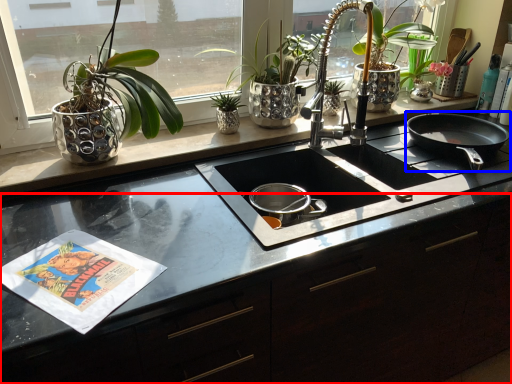
Question: Which object is further to the camera taking this photo, counter (highlighted by a red box) or frying pan (highlighted by a blue box)?

Choices:
 (A) counter
 (B) frying pan

Answer: (B)